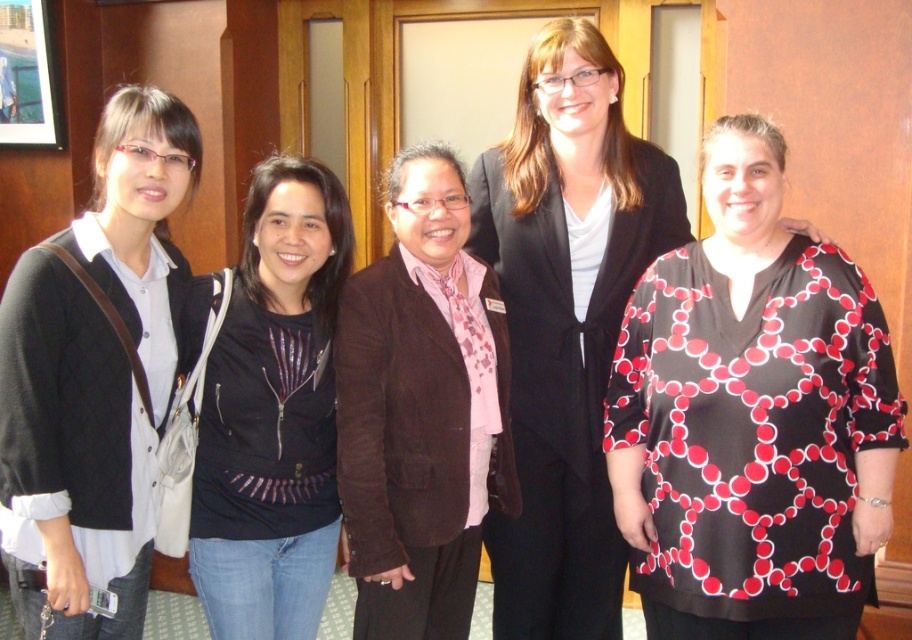
You are organizing a photoshoot and need to ensure that the black textured blouse at center and the black sequined jacket at center can fit side by side on a mannequin. Given that the mannequin has a width of 1 meter, can both items be placed next to each other without overlapping?

The black textured blouse at center might be wider than black sequined jacket at center, so it is uncertain if both can fit on the mannequin without overlapping. Measure their combined width to confirm.

You are a photographer standing 2 meters away from the black matte cardigan at left. You want to take a photo of the camera that is 1.68 meters away from the cardigan. Can you capture the camera in your shot without moving closer?

The camera is 1.68 meters away from the black matte cardigan at left. Since you are 2 meters away from the cardigan, the camera is within your shooting range. Therefore, you can capture the camera in your shot without moving closer.

You are a photographer taking a group photo of the women in the scene. You need to adjust their positions so that the black matte cardigan at left and the black sequined jacket at center are at the same height in the photo. Which adjustment should you make?

Since the black matte cardigan at left is much taller than the black sequined jacket at center, you should have the black matte cardigan at left stand slightly lower or the black sequined jacket at center stand higher to balance their heights in the photo.